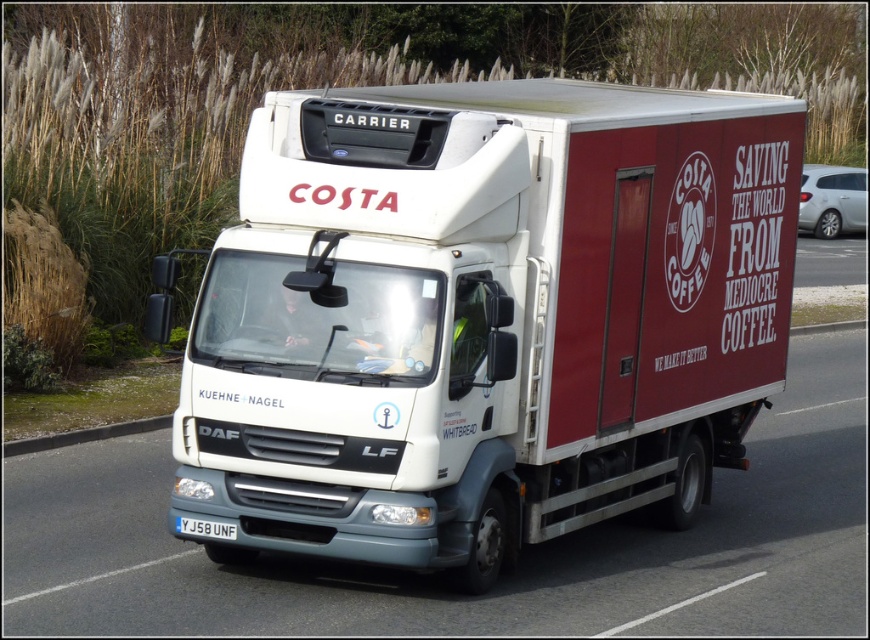
Is point (770, 371) farther from camera compared to point (231, 538)?

Yes.

Does white matte truck at center come behind white plastic license plate at center?

No, it is in front of white plastic license plate at center.

The width and height of the screenshot is (870, 640). What do you see at coordinates (485, 316) in the screenshot?
I see `white matte truck at center` at bounding box center [485, 316].

Locate an element on the screen. Image resolution: width=870 pixels, height=640 pixels. white matte truck at center is located at coordinates (485, 316).